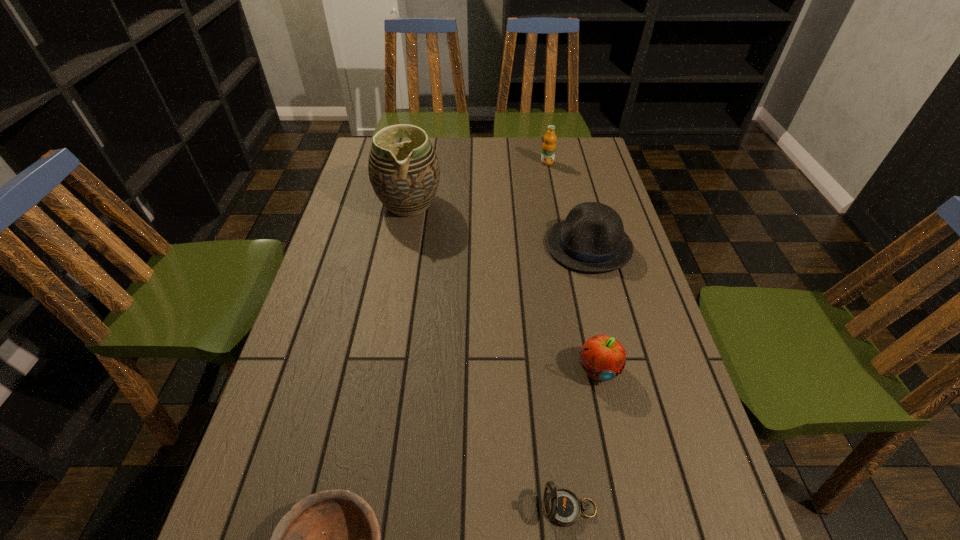
Where is `blank space located on the front of the apple`? blank space located on the front of the apple is located at coordinates (630, 525).

Locate an element on the screen. This screenshot has width=960, height=540. vacant space situated 0.060m on the face of the second shortest object is located at coordinates (509, 508).

Where is `vacant space situated 0.100m on the face of the second shortest object`? vacant space situated 0.100m on the face of the second shortest object is located at coordinates (487, 508).

The width and height of the screenshot is (960, 540). What are the coordinates of `free space located 0.340m on the face of the second shortest object` in the screenshot? It's located at (353, 508).

Identify the location of object at the far edge. The image size is (960, 540). (549, 145).

Identify the location of object present at the left edge. (405, 176).

Find the location of a particular element. bowler hat located in the right edge section of the desktop is located at coordinates [x=591, y=239].

This screenshot has width=960, height=540. Find the location of `apple present at the right edge`. apple present at the right edge is located at coordinates (602, 357).

At what (x,y) coordinates should I click in order to perform the action: click on vacant space at the far edge of the desktop. Please return your answer as a coordinate pair (x, y). The height and width of the screenshot is (540, 960). Looking at the image, I should click on (476, 165).

At what (x,y) coordinates should I click in order to perform the action: click on vacant space at the left edge of the desktop. Please return your answer as a coordinate pair (x, y). The image size is (960, 540). Looking at the image, I should click on (375, 242).